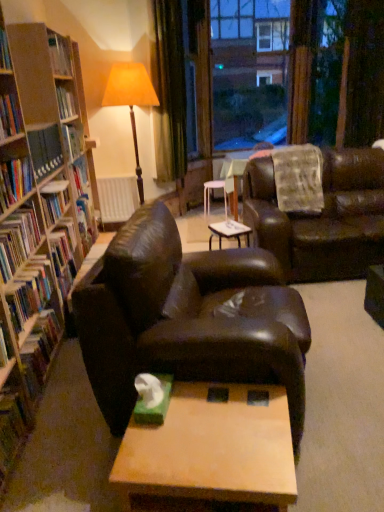
Question: From a real-world perspective, is hardcover book at left, which ranks as the 2th book in top-to-bottom order, above or below leather couch at center, placed as the second studio couch when sorted from left to right?

Choices:
 (A) below
 (B) above

Answer: (B)

Question: Relative to leather couch at center, placed as the second studio couch when sorted from left to right, is hardcover book at left, which ranks as the 2th book in top-to-bottom order, in front or behind?

Choices:
 (A) front
 (B) behind

Answer: (A)

Question: Estimate the real-world distances between objects in this image. Which object is farther from the matte orange fabric lampshade at upper center?

Choices:
 (A) hardcover book at left, the 4th book from the top
 (B) wooden coffee table at center, placed as the second table when sorted from top to bottom
 (C) hardcover book at left, which ranks as the 2th book in top-to-bottom order
 (D) green velvet curtain at upper center
 (E) hardcover book at left, marked as the 1th book in a top-to-bottom arrangement

Answer: (B)

Question: Estimate the real-world distances between objects in this image. Which object is farther from the hardcover book at left, which ranks as the 6th book in top-to-bottom order?

Choices:
 (A) transparent glass window at upper center
 (B) matte orange fabric lampshade at upper center
 (C) white plastic table at center, the 1th table from the top
 (D) hardcover book at left, which is the fifth book in top-to-bottom order
 (E) leather couch at center, the first studio couch when ordered from back to front

Answer: (A)